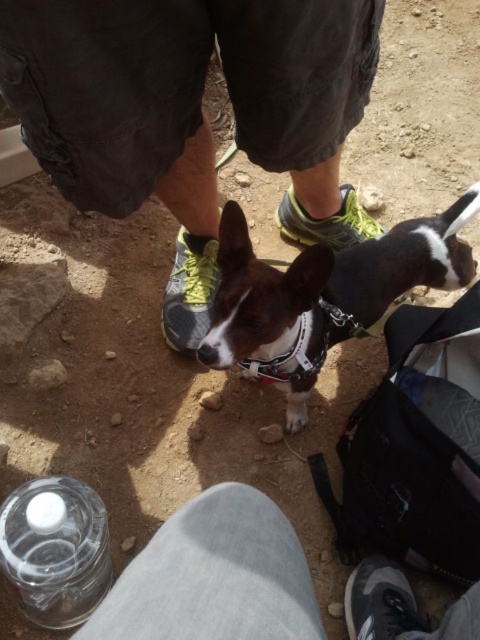
Question: Which point is closer to the camera?

Choices:
 (A) matte black shoe at lower center
 (B) clear plastic bottle at lower left

Answer: (A)

Question: Is clear plastic bottle at lower left closer to camera compared to gray mesh shoe at center?

Choices:
 (A) no
 (B) yes

Answer: (B)

Question: Among these points, which one is nearest to the camera?

Choices:
 (A) (49, 552)
 (B) (71, 195)
 (C) (348, 192)

Answer: (B)

Question: Which point is closer to the camera?

Choices:
 (A) matte black shorts at center
 (B) neon yellow mesh sneaker at center
 (C) matte black shoe at lower center

Answer: (A)

Question: From the image, what is the correct spatial relationship of brown matte dog at center in relation to matte black shoe at lower center?

Choices:
 (A) right
 (B) left

Answer: (B)

Question: Can you confirm if gray mesh shoe at center is positioned above neon yellow mesh sneaker at center?

Choices:
 (A) yes
 (B) no

Answer: (B)